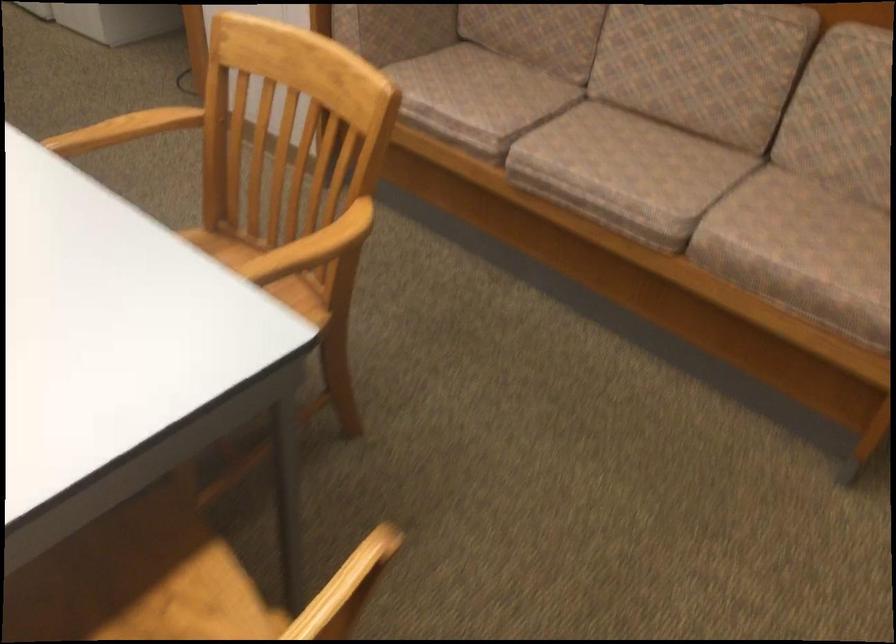
Locate an element on the screen. The height and width of the screenshot is (644, 896). chair sitting surface is located at coordinates (218, 247).